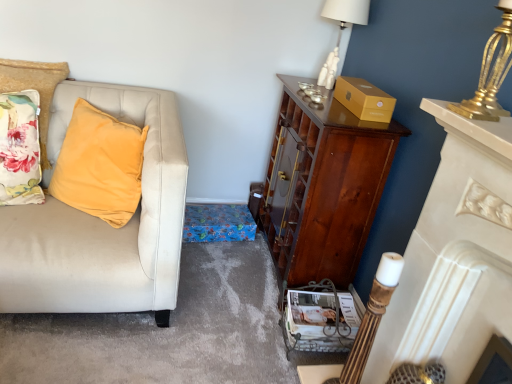
What do you see at coordinates (341, 30) in the screenshot?
I see `white ceramic lamp at upper right, arranged as the first lamp when viewed from the top` at bounding box center [341, 30].

Find the location of a particular element. The width and height of the screenshot is (512, 384). velvet yellow pillow at left is located at coordinates (102, 222).

What do you see at coordinates (364, 99) in the screenshot? The image size is (512, 384). I see `gold cardboard box at upper right` at bounding box center [364, 99].

This screenshot has height=384, width=512. What do you see at coordinates (34, 88) in the screenshot?
I see `floral fabric pillow at left` at bounding box center [34, 88].

Measure the distance between gold metallic lamp at upper right, which appears as the 2th lamp when viewed from the top, and camera.

gold metallic lamp at upper right, which appears as the 2th lamp when viewed from the top, is 97.70 centimeters away from camera.

Find the location of a particular element. matte white magazine at lower center is located at coordinates (321, 315).

The image size is (512, 384). Find the location of `white ceramic lamp at upper right, which is the first lamp in left-to-right order`. white ceramic lamp at upper right, which is the first lamp in left-to-right order is located at coordinates (341, 30).

From the image's perspective, is floral fabric pillow at left above or below matte white magazine at lower center?

floral fabric pillow at left is above matte white magazine at lower center.

Is floral fabric pillow at left positioned far away from matte white magazine at lower center?

Absolutely, floral fabric pillow at left is distant from matte white magazine at lower center.

At what (x,y) coordinates should I click in order to perform the action: click on cushion on the left of matte white magazine at lower center. Please return your answer as a coordinate pair (x, y). Looking at the image, I should click on (34, 88).

Considering the points (47, 109) and (312, 306), which point is behind, point (47, 109) or point (312, 306)?

The point (47, 109) is farther.

Where is `cabinetry below the velvet yellow pillow at left (from the image's perspective)`? The width and height of the screenshot is (512, 384). cabinetry below the velvet yellow pillow at left (from the image's perspective) is located at coordinates (322, 187).

Who is taller, shiny brown cabinet at right or velvet yellow pillow at left?

With more height is shiny brown cabinet at right.

Is shiny brown cabinet at right not within velvet yellow pillow at left?

That's correct, shiny brown cabinet at right is outside of velvet yellow pillow at left.

Can you confirm if shiny brown cabinet at right is positioned to the right of velvet yellow pillow at left?

Yes, shiny brown cabinet at right is to the right of velvet yellow pillow at left.

Does floral fabric pillow at left turn towards gold cardboard box at upper right?

No, floral fabric pillow at left is not turned towards gold cardboard box at upper right.

How many degrees apart are the facing directions of floral fabric pillow at left and gold cardboard box at upper right?

89.9 degrees.

Which point is more forward, (68,69) or (378,112)?

Point (378,112)

Does floral fabric pillow at left have a greater width compared to gold cardboard box at upper right?

Indeed, floral fabric pillow at left has a greater width compared to gold cardboard box at upper right.

Does shiny brown cabinet at right have a lesser height compared to gold metallic lamp at upper right, which is the first lamp in bottom-to-top order?

No.

Can you confirm if shiny brown cabinet at right is positioned to the left of gold metallic lamp at upper right, which is counted as the 1th lamp, starting from the front?

Indeed, shiny brown cabinet at right is positioned on the left side of gold metallic lamp at upper right, which is counted as the 1th lamp, starting from the front.

Which object is more forward, shiny brown cabinet at right or gold metallic lamp at upper right, the second lamp from the back?

gold metallic lamp at upper right, the second lamp from the back.

Could you measure the distance between shiny brown cabinet at right and gold metallic lamp at upper right, which is counted as the 1th lamp, starting from the right?

30.74 inches.

Considering their positions, is floral fabric pillow at left located in front of or behind shiny brown cabinet at right?

In the image, floral fabric pillow at left appears behind shiny brown cabinet at right.

Identify the location of cabinetry in front of the floral fabric pillow at left. This screenshot has width=512, height=384. (322, 187).

How different are the orientations of floral fabric pillow at left and shiny brown cabinet at right in degrees?

They differ by 89.9 degrees in their facing directions.

From a real-world perspective, who is located lower, floral fabric pillow at left or shiny brown cabinet at right?

From a 3D spatial view, shiny brown cabinet at right is below.

Are white ceramic lamp at upper right, the 2th lamp from the right, and matte white magazine at lower center making contact?

No, white ceramic lamp at upper right, the 2th lamp from the right, is not making contact with matte white magazine at lower center.

Looking at this image, can we say white ceramic lamp at upper right, the 2th lamp from the right, lies outside matte white magazine at lower center?

Yes, white ceramic lamp at upper right, the 2th lamp from the right, is outside of matte white magazine at lower center.

From the picture: Between white ceramic lamp at upper right, which is counted as the second lamp, starting from the front, and matte white magazine at lower center, which one has smaller width?

white ceramic lamp at upper right, which is counted as the second lamp, starting from the front, is thinner.

Starting from the matte white magazine at lower center, which lamp is the 1st one to the right? Please provide its 2D coordinates.

[(341, 30)]

How far apart are white ceramic lamp at upper right, which is counted as the second lamp, starting from the front, and white glossy fireplace at right?

The distance of white ceramic lamp at upper right, which is counted as the second lamp, starting from the front, from white glossy fireplace at right is 3.75 feet.

Is point (321, 78) farther from camera compared to point (415, 292)?

Yes, it is behind point (415, 292).

Is the surface of white ceramic lamp at upper right, arranged as the first lamp when viewed from the top, in direct contact with white glossy fireplace at right?

No, white ceramic lamp at upper right, arranged as the first lamp when viewed from the top, is not making contact with white glossy fireplace at right.

Which of these two, white ceramic lamp at upper right, the second lamp positioned from the bottom, or white glossy fireplace at right, is smaller?

Smaller between the two is white ceramic lamp at upper right, the second lamp positioned from the bottom.

At what (x,y) coordinates should I click in order to perform the action: click on cushion above the matte white magazine at lower center (from the image's perspective). Please return your answer as a coordinate pair (x, y). The image size is (512, 384). Looking at the image, I should click on (34, 88).

The width and height of the screenshot is (512, 384). Identify the location of studio couch on the left of the shiny brown cabinet at right. coord(102,222).

Based on their spatial positions, is gold metallic lamp at upper right, the second lamp from the back, or shiny brown cabinet at right further from floral fabric pillow at left?

The object further to floral fabric pillow at left is gold metallic lamp at upper right, the second lamp from the back.

Estimate the real-world distances between objects in this image. Which object is further from velvet yellow pillow at left, matte white magazine at lower center or white ceramic lamp at upper right, arranged as the first lamp when viewed from the top?

The object further to velvet yellow pillow at left is white ceramic lamp at upper right, arranged as the first lamp when viewed from the top.

Based on their spatial positions, is gold metallic lamp at upper right, placed as the 2th lamp when sorted from left to right, or matte white magazine at lower center further from gold cardboard box at upper right?

Among the two, matte white magazine at lower center is located further to gold cardboard box at upper right.

Based on their spatial positions, is velvet yellow pillow at left or matte white magazine at lower center further from white ceramic lamp at upper right, which is the first lamp in left-to-right order?

The object further to white ceramic lamp at upper right, which is the first lamp in left-to-right order, is velvet yellow pillow at left.

Based on their spatial positions, is gold cardboard box at upper right or matte white magazine at lower center further from white glossy fireplace at right?

gold cardboard box at upper right is further to white glossy fireplace at right.

Looking at the image, which one is located further to white glossy fireplace at right, shiny brown cabinet at right or gold metallic lamp at upper right, the second lamp from the back?

Based on the image, shiny brown cabinet at right appears to be further to white glossy fireplace at right.

Looking at the image, which one is located closer to gold metallic lamp at upper right, which is counted as the 1th lamp, starting from the right, white glossy fireplace at right or white ceramic lamp at upper right, the second lamp positioned from the bottom?

white glossy fireplace at right is closer to gold metallic lamp at upper right, which is counted as the 1th lamp, starting from the right.

Estimate the real-world distances between objects in this image. Which object is closer to matte white magazine at lower center, white glossy fireplace at right or white ceramic lamp at upper right, which is the 1th lamp from back to front?

Among the two, white glossy fireplace at right is located nearer to matte white magazine at lower center.

Locate an element on the screen. The width and height of the screenshot is (512, 384). magazine between floral fabric pillow at left and gold cardboard box at upper right from left to right is located at coordinates (321, 315).

You are a GUI agent. You are given a task and a screenshot of the screen. Output one action in this format:
    pyautogui.click(x=<x>, y=<y>)
    Task: Click on the lamp between floral fabric pillow at left and gold metallic lamp at upper right, the second lamp from the back, from left to right
    
    Given the screenshot: What is the action you would take?
    pyautogui.click(x=341, y=30)

Find the location of a particular element. magazine situated between velvet yellow pillow at left and shiny brown cabinet at right from left to right is located at coordinates (321, 315).

Where is `box between white ceramic lamp at upper right, which is counted as the second lamp, starting from the front, and matte white magazine at lower center from top to bottom`? This screenshot has height=384, width=512. box between white ceramic lamp at upper right, which is counted as the second lamp, starting from the front, and matte white magazine at lower center from top to bottom is located at coordinates (364, 99).